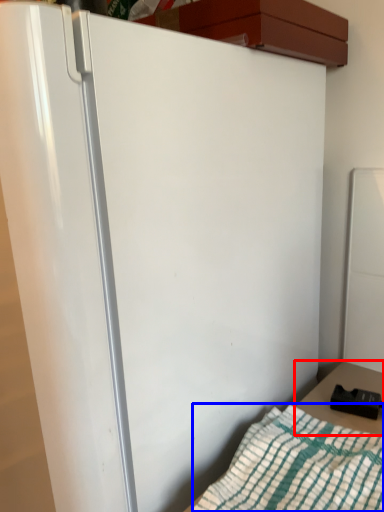
Question: Which object is further to the camera taking this photo, table (highlighted by a red box) or blanket (highlighted by a blue box)?

Choices:
 (A) table
 (B) blanket

Answer: (A)